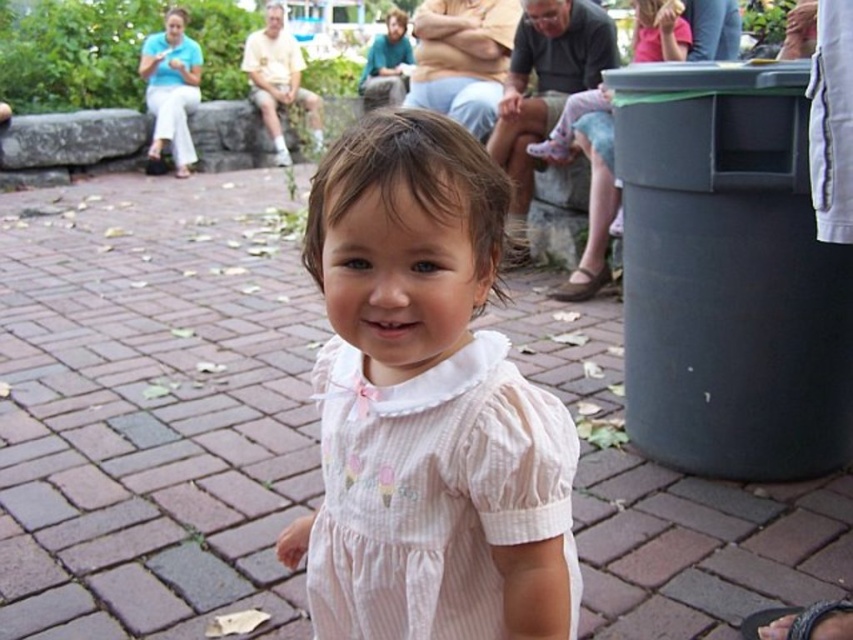
Who is higher up, pink fabric dress at lower right or brown leather sandal at right?

pink fabric dress at lower right is higher up.

Which of these two, pink fabric dress at lower right or brown leather sandal at right, stands taller?

pink fabric dress at lower right is taller.

What do you see at coordinates (589, 182) in the screenshot? I see `pink fabric dress at lower right` at bounding box center [589, 182].

Find the location of a particular element. pink fabric dress at lower right is located at coordinates (589, 182).

What do you see at coordinates (433, 493) in the screenshot? I see `pink striped dress at center` at bounding box center [433, 493].

Does point (410, 483) come farther from viewer compared to point (610, 179)?

That is False.

Which is in front, point (349, 365) or point (550, 145)?

Point (349, 365) is more forward.

I want to click on pink striped dress at center, so click(x=433, y=493).

In the scene shown: Who is lower down, pink striped dress at center or brown leather sandal at right?

pink striped dress at center

Between pink striped dress at center and brown leather sandal at right, which one appears on the left side from the viewer's perspective?

pink striped dress at center

Image resolution: width=853 pixels, height=640 pixels. What do you see at coordinates (433, 493) in the screenshot? I see `pink striped dress at center` at bounding box center [433, 493].

Locate an element on the screen. Image resolution: width=853 pixels, height=640 pixels. pink striped dress at center is located at coordinates (433, 493).